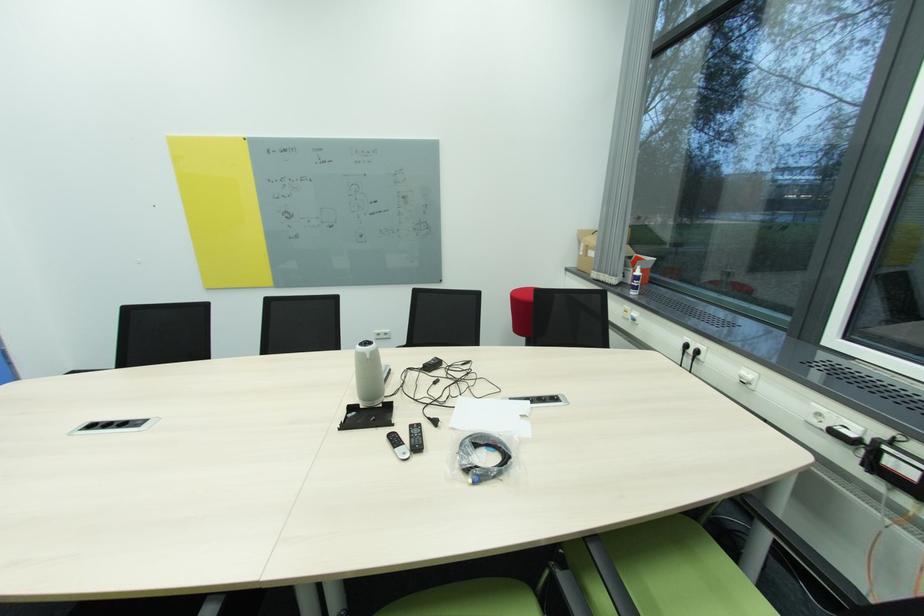
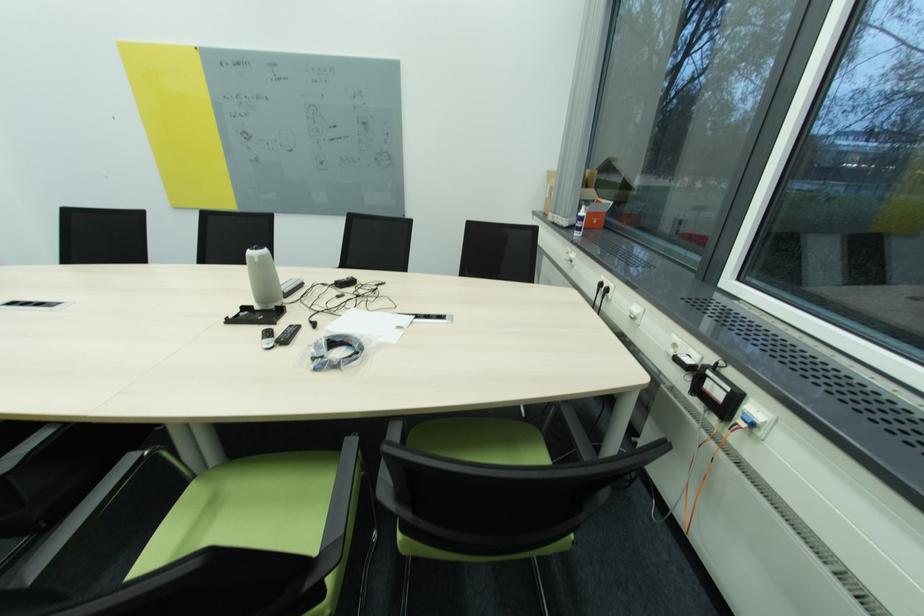
Locate, in the second image, the point that corresponds to pixel 408 455 in the first image.

(273, 345)